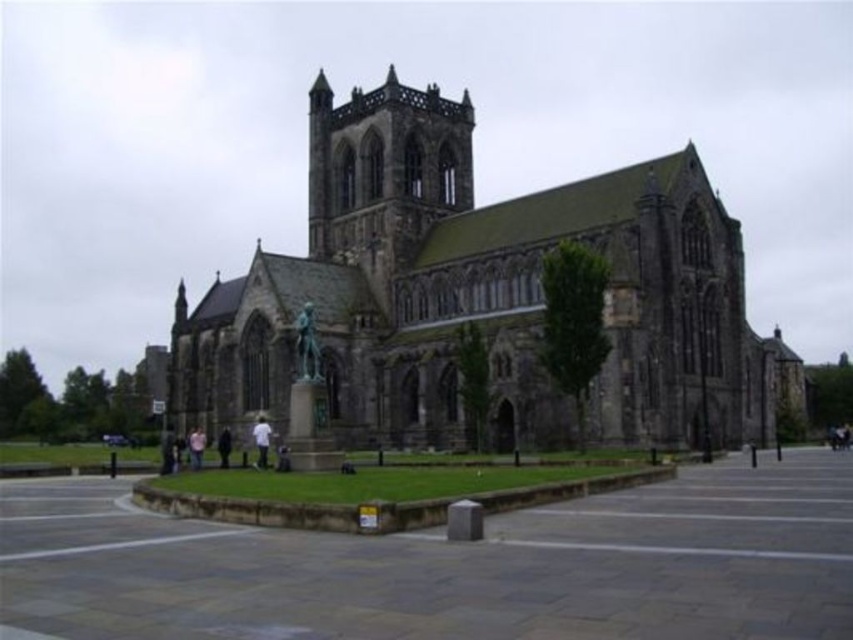
You are a photographer planning to take a picture of the dark gray stone church at center and the dark blue fabric person at lower center. To ensure both subjects are fully visible in the frame, which subject should be positioned closer to the camera to avoid being cut off?

The dark blue fabric person at lower center should be positioned closer to the camera because the dark gray stone church at center might be wider than the dark blue fabric person at lower center, making the church more likely to extend beyond the frame if both are at the same distance.

You are an artist planning to paint the cathedral scene. You want to ensure the proportions between the white fabric shirt at center and the dark blue fabric person at lower center are accurate. Which one should you draw to be wider?

The dark blue fabric person at lower center should be drawn wider since the white fabric shirt at center has a lesser width compared to it.

You are a tourist visiting the cathedral and notice two items at the center of the image. One is the bronze statue at center and the other is the white fabric shirt at center. Which one is closer to you as you face the cathedral?

The bronze statue at center is closer to you because it is in front of the white fabric shirt at center.